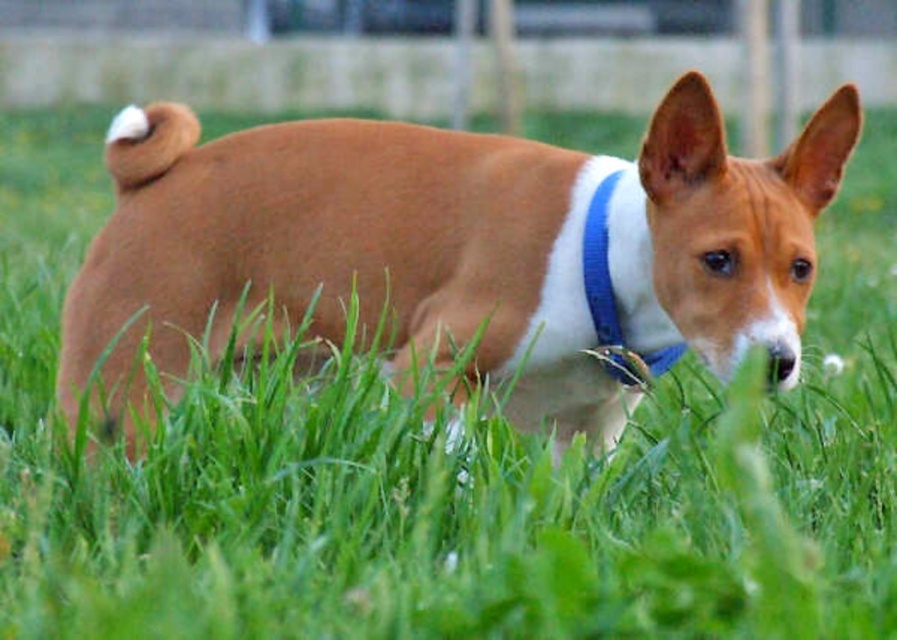
You are taking a photo of the dog and notice two points in the image labeled as point [344,312] and point [588,236]. Which point is closer to the camera?

Point [588,236] is closer to the camera because the description states that point [344,312] is further away.